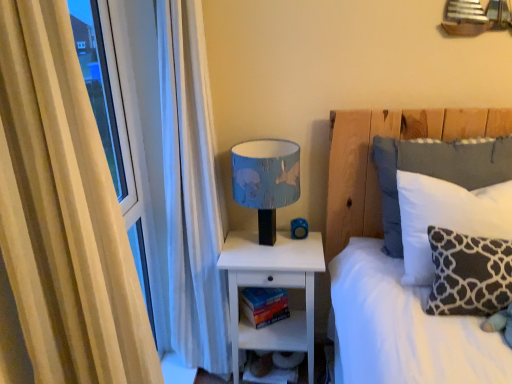
Question: Is beige fabric curtain at left to the right of dark gray velvety pillow at right, which is counted as the first pillow, starting from the front, from the viewer's perspective?

Choices:
 (A) yes
 (B) no

Answer: (B)

Question: Does beige fabric curtain at left come behind dark gray velvety pillow at right, which is counted as the first pillow, starting from the front?

Choices:
 (A) no
 (B) yes

Answer: (A)

Question: From the image's perspective, is beige fabric curtain at left above dark gray velvety pillow at right, which is counted as the first pillow, starting from the front?

Choices:
 (A) yes
 (B) no

Answer: (A)

Question: Is the surface of beige fabric curtain at left in direct contact with dark gray velvety pillow at right, which is counted as the first pillow, starting from the front?

Choices:
 (A) no
 (B) yes

Answer: (A)

Question: Is beige fabric curtain at left in front of dark gray velvety pillow at right, which is counted as the first pillow, starting from the front?

Choices:
 (A) yes
 (B) no

Answer: (A)

Question: Can you confirm if beige fabric curtain at left is thinner than dark gray velvety pillow at right, arranged as the 3th pillow when viewed from the back?

Choices:
 (A) no
 (B) yes

Answer: (A)

Question: From the image's perspective, is dark gray velvety pillow at right, arranged as the 3th pillow when viewed from the back, located above hardcover book at lower center?

Choices:
 (A) yes
 (B) no

Answer: (A)

Question: Considering the relative sizes of dark gray velvety pillow at right, which is counted as the first pillow, starting from the front, and hardcover book at lower center in the image provided, is dark gray velvety pillow at right, which is counted as the first pillow, starting from the front, smaller than hardcover book at lower center?

Choices:
 (A) no
 (B) yes

Answer: (A)

Question: From a real-world perspective, is dark gray velvety pillow at right, which is counted as the first pillow, starting from the front, positioned under hardcover book at lower center based on gravity?

Choices:
 (A) no
 (B) yes

Answer: (A)

Question: Would you say dark gray velvety pillow at right, arranged as the 3th pillow when viewed from the back, is outside hardcover book at lower center?

Choices:
 (A) yes
 (B) no

Answer: (A)

Question: Is dark gray velvety pillow at right, which is counted as the first pillow, starting from the front, facing away from hardcover book at lower center?

Choices:
 (A) no
 (B) yes

Answer: (A)

Question: From the image's perspective, is dark gray velvety pillow at right, which is counted as the first pillow, starting from the front, located beneath hardcover book at lower center?

Choices:
 (A) yes
 (B) no

Answer: (B)

Question: Can dark gray velvety pillow at right, arranged as the 3th pillow when viewed from the back, be found inside white soft pillow at upper right, which is the first pillow in back-to-front order?

Choices:
 (A) yes
 (B) no

Answer: (B)